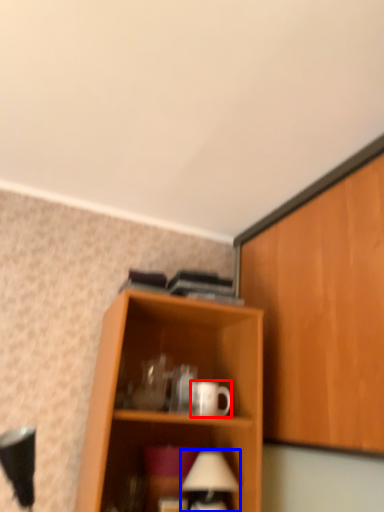
Question: Which of the following is the farthest to the observer, mug (highlighted by a red box) or table lamp (highlighted by a blue box)?

Choices:
 (A) mug
 (B) table lamp

Answer: (A)